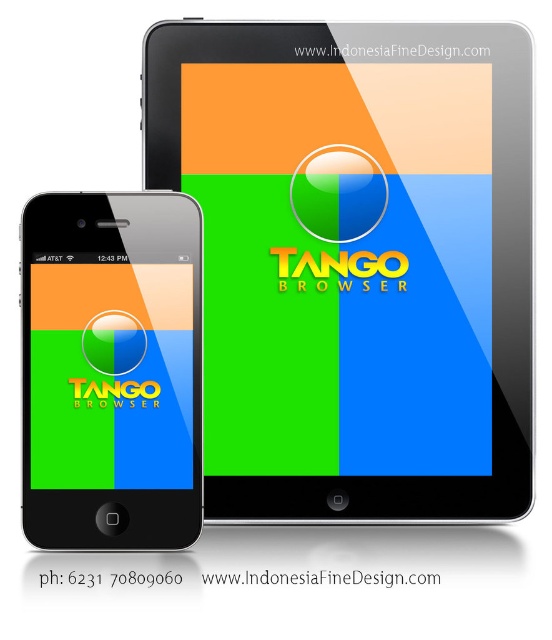
Question: Does matte black tablet at center have a lesser width compared to matte black smartphone at left?

Choices:
 (A) no
 (B) yes

Answer: (A)

Question: Among these objects, which one is nearest to the camera?

Choices:
 (A) matte black smartphone at left
 (B) green glossy sphere at lower left
 (C) matte black tablet at center

Answer: (A)

Question: From the image, what is the correct spatial relationship of matte black tablet at center in relation to matte black smartphone at left?

Choices:
 (A) right
 (B) left

Answer: (A)

Question: Estimate the real-world distances between objects in this image. Which object is farther from the matte black smartphone at left?

Choices:
 (A) matte black tablet at center
 (B) green glossy sphere at lower left

Answer: (A)

Question: Which of the following is the closest to the observer?

Choices:
 (A) (125, 330)
 (B) (131, 332)

Answer: (A)

Question: Is matte black smartphone at left thinner than green glossy sphere at lower left?

Choices:
 (A) no
 (B) yes

Answer: (A)